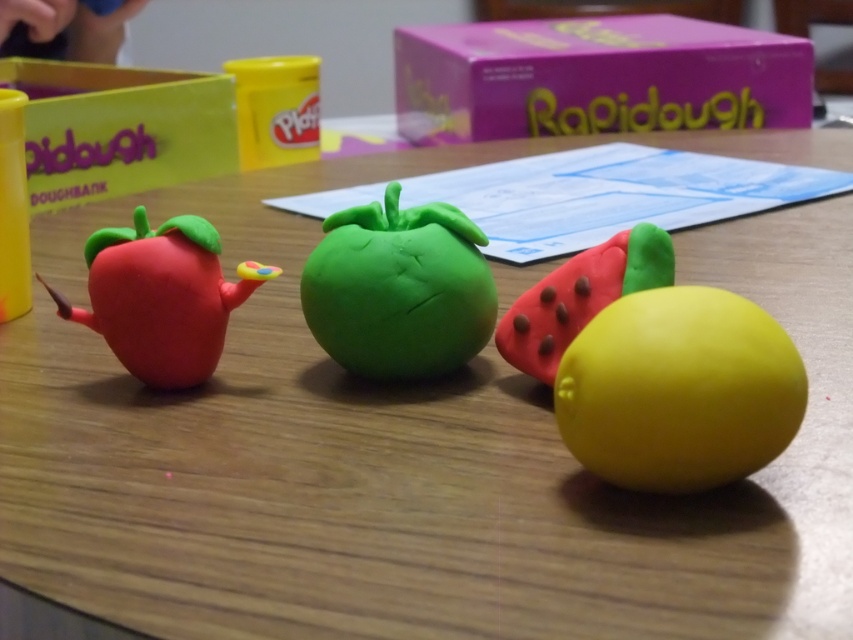
Question: Can you confirm if green clay apple at center is bigger than rubberized matte strawberry at center-right?

Choices:
 (A) yes
 (B) no

Answer: (A)

Question: Can you confirm if yellow matte lemon at lower right is bigger than rubberized matte strawberry at center-right?

Choices:
 (A) no
 (B) yes

Answer: (A)

Question: Which point is farther to the camera?

Choices:
 (A) matte yellow box at upper left
 (B) green clay apple at center
 (C) yellow matte play-doh container at upper center
 (D) yellow matte lemon at lower right

Answer: (C)

Question: Among these objects, which one is farthest from the camera?

Choices:
 (A) matte yellow box at upper left
 (B) yellow matte play-doh container at upper center
 (C) pink cardboard box at upper center
 (D) green clay apple at center

Answer: (C)

Question: Does matte plastic strawberry at left appear over yellow matte play-doh container at upper center?

Choices:
 (A) no
 (B) yes

Answer: (A)

Question: Which point is farther to the camera?

Choices:
 (A) (254, 168)
 (B) (743, 417)
 (C) (134, 160)
 (D) (248, 285)

Answer: (A)